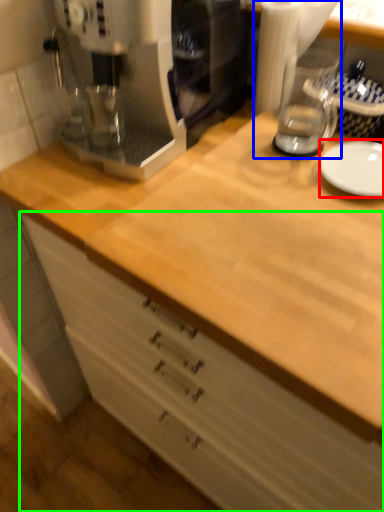
Question: Which object is the farthest from plate (highlighted by a red box)? Choose among these: blender (highlighted by a blue box) or cabinetry (highlighted by a green box).

Choices:
 (A) blender
 (B) cabinetry

Answer: (B)